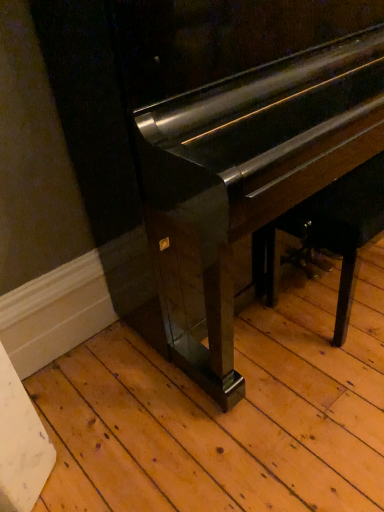
What is the approximate height of glossy black piano at center?

glossy black piano at center is 3.40 feet in height.

In order to click on glossy black piano at center in this screenshot , I will do `click(246, 180)`.

What do you see at coordinates (246, 180) in the screenshot? I see `glossy black piano at center` at bounding box center [246, 180].

I want to click on glossy black piano at center, so click(x=246, y=180).